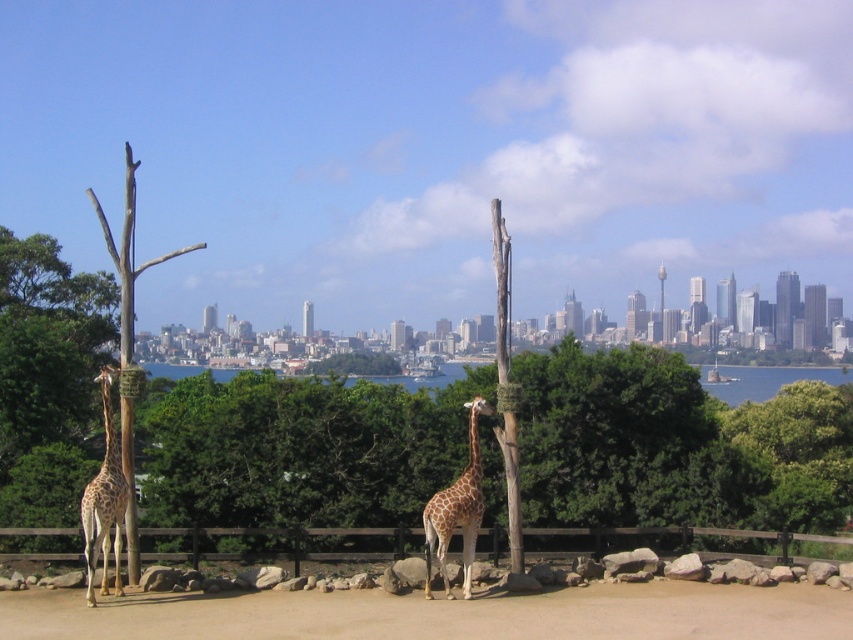
You are a zookeeper who needs to place a new feeding station in the enclosure. The feeding station must be placed on the brown sandy dirt at center and must be accessible to the spotted fur giraffe at left. Based on their positions, can the giraffe reach the feeding station from its current position?

The brown sandy dirt at center is located below the spotted fur giraffe at left, so the giraffe can easily reach the feeding station placed there as it is positioned directly beneath them.

You are a zookeeper who needs to ensure the giraffes are visible to visitors. The spotted fur giraffe at left and the spotted brown giraffe at center are in the enclosure. Which giraffe should you position closer to the viewing area so visitors can see it better?

The spotted fur giraffe at left is bigger than the spotted brown giraffe at center, so positioning the spotted fur giraffe at left closer to the viewing area would make it more visible to visitors.